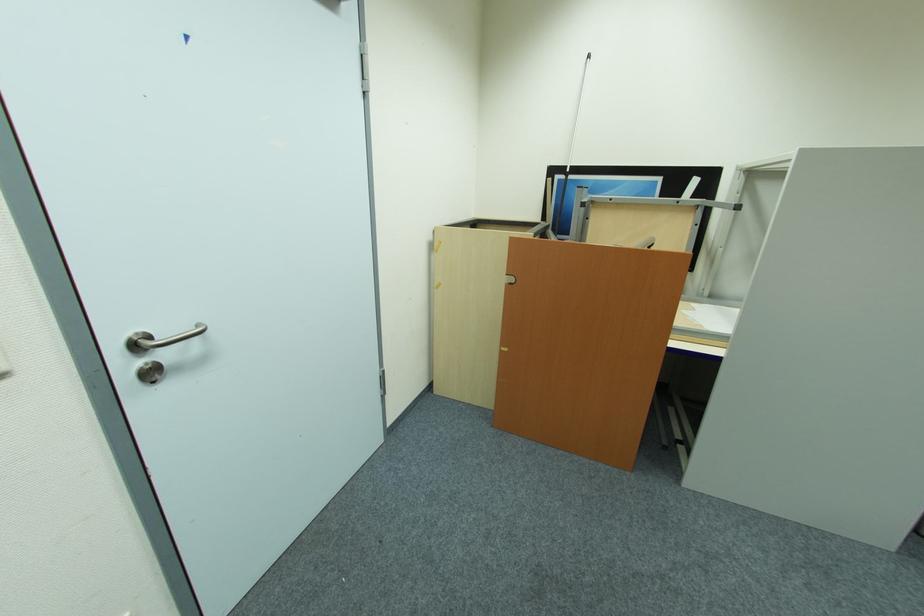
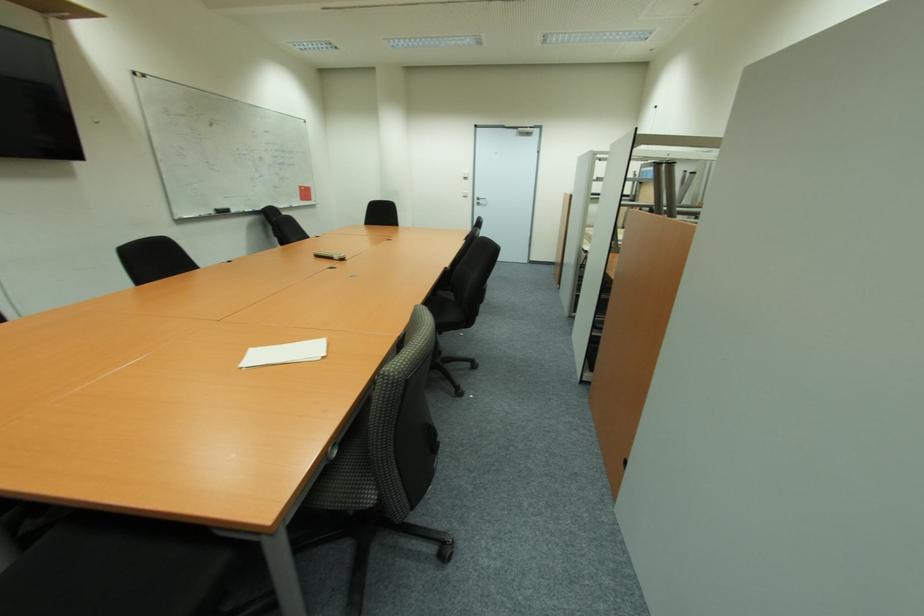
In the second image, find the point that corresponds to point (169, 355) in the first image.

(483, 203)